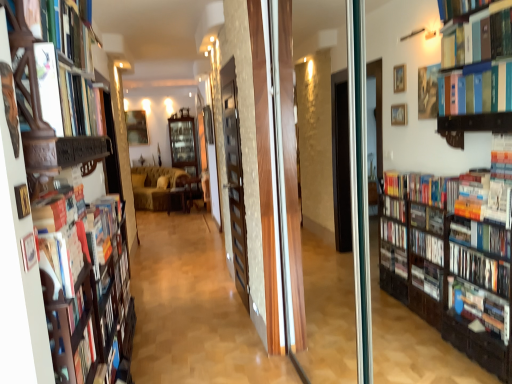
Where is `vacant area in front of wooden screen door at center`? The image size is (512, 384). vacant area in front of wooden screen door at center is located at coordinates (219, 322).